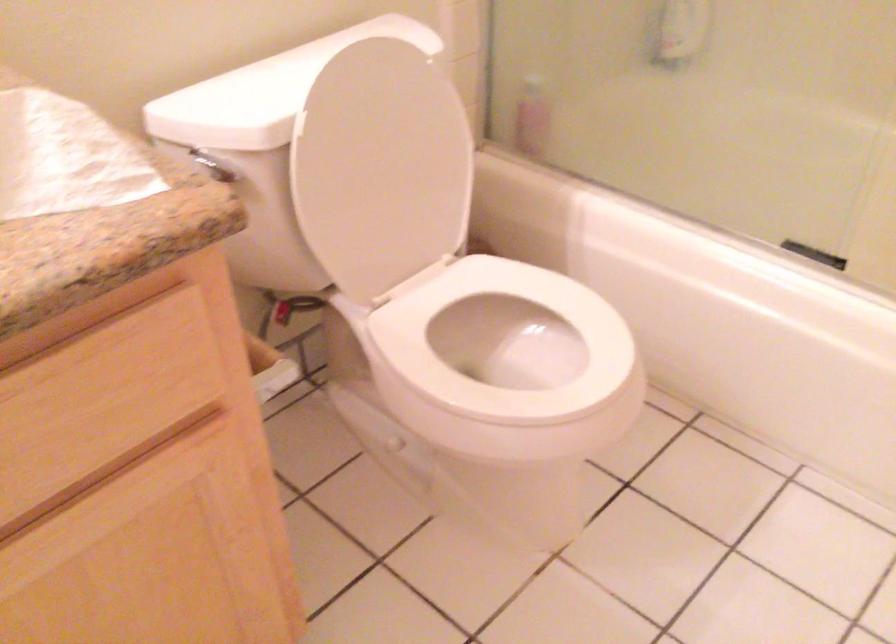
The image size is (896, 644). Describe the element at coordinates (209, 164) in the screenshot. I see `the silver flush lever` at that location.